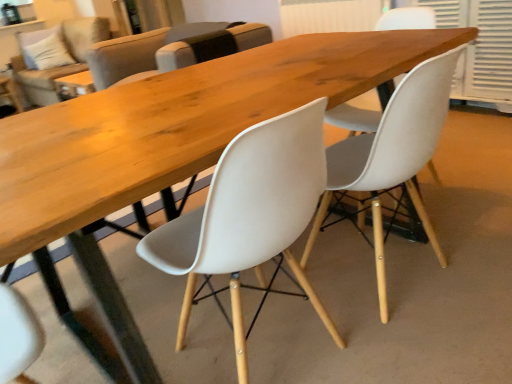
Where is `matte white chair at center, acting as the 3th chair starting from the back`? matte white chair at center, acting as the 3th chair starting from the back is located at coordinates (249, 217).

What do you see at coordinates (61, 65) in the screenshot?
I see `beige fabric couch at upper left` at bounding box center [61, 65].

The width and height of the screenshot is (512, 384). I want to click on white plastic chair at center, which is the 2th chair in back-to-front order, so click(x=393, y=155).

This screenshot has height=384, width=512. I want to click on matte white chair at center, which is the first chair from front to back, so click(249, 217).

From a real-world perspective, is beige fabric couch at upper left above or below white textured shutter at upper right?

From a real-world perspective, beige fabric couch at upper left is physically above white textured shutter at upper right.

Does beige fabric couch at upper left have a larger size compared to white textured shutter at upper right?

Indeed, beige fabric couch at upper left has a larger size compared to white textured shutter at upper right.

Consider the image. Considering the positions of objects beige fabric couch at upper left and white textured shutter at upper right in the image provided, who is more to the right, beige fabric couch at upper left or white textured shutter at upper right?

white textured shutter at upper right.

In the image, is matte white chair at center, acting as the 3th chair starting from the back, positioned in front of or behind white plastic chair at center, which is the 3th chair from front to back?

matte white chair at center, acting as the 3th chair starting from the back, is in front of white plastic chair at center, which is the 3th chair from front to back.

Is white plastic chair at center, acting as the first chair starting from the back, inside matte white chair at center, acting as the 3th chair starting from the back?

No, matte white chair at center, acting as the 3th chair starting from the back, does not contain white plastic chair at center, acting as the first chair starting from the back.

Between matte white chair at center, acting as the 3th chair starting from the back, and white plastic chair at center, acting as the first chair starting from the back, which one appears on the left side from the viewer's perspective?

white plastic chair at center, acting as the first chair starting from the back.

Considering the sizes of objects matte white chair at center, acting as the 3th chair starting from the back, and white plastic chair at center, which is the 3th chair from front to back, in the image provided, who is wider, matte white chair at center, acting as the 3th chair starting from the back, or white plastic chair at center, which is the 3th chair from front to back,?

white plastic chair at center, which is the 3th chair from front to back.

Which is in front, point (27, 64) or point (384, 191)?

The point (384, 191) is closer to the camera.

From the image's perspective, is beige fabric couch at upper left located above or below white plastic chair at center, the 2th chair viewed from the front?

beige fabric couch at upper left is situated higher than white plastic chair at center, the 2th chair viewed from the front, in the image.

Could white plastic chair at center, which is the 2th chair in back-to-front order, be considered to be inside beige fabric couch at upper left?

No, white plastic chair at center, which is the 2th chair in back-to-front order, is located outside of beige fabric couch at upper left.

Is beige fabric couch at upper left positioned with its back to white plastic chair at center, which is the 2th chair in back-to-front order?

No, white plastic chair at center, which is the 2th chair in back-to-front order, is not at the back of beige fabric couch at upper left.

Image resolution: width=512 pixels, height=384 pixels. In order to click on couch that is on the left side of matte white chair at center, which is the first chair from front to back in this screenshot , I will do `click(61, 65)`.

Is point (243, 257) positioned after point (39, 40)?

No, (243, 257) is in front of (39, 40).

Is matte white chair at center, acting as the 3th chair starting from the back, further to the viewer compared to beige fabric couch at upper left?

No, it is in front of beige fabric couch at upper left.

Considering the positions of objects white plastic chair at center, the 2th chair viewed from the front, and beige fabric couch at upper left in the image provided, who is in front, white plastic chair at center, the 2th chair viewed from the front, or beige fabric couch at upper left?

white plastic chair at center, the 2th chair viewed from the front, is more forward.

Is white plastic chair at center, which is the 2th chair in back-to-front order, facing towards beige fabric couch at upper left?

Yes.

Which of these two, white plastic chair at center, the 2th chair viewed from the front, or beige fabric couch at upper left, stands shorter?

white plastic chair at center, the 2th chair viewed from the front, is shorter.

Between white plastic chair at center, which is the 2th chair in back-to-front order, and beige fabric couch at upper left, which one has larger size?

Bigger between the two is beige fabric couch at upper left.

Which is less distant, (x=105, y=29) or (x=307, y=126)?

Point (x=307, y=126)

Would you say beige fabric couch at upper left contains matte white chair at center, acting as the 3th chair starting from the back?

No, beige fabric couch at upper left does not contain matte white chair at center, acting as the 3th chair starting from the back.

Can you confirm if beige fabric couch at upper left is positioned to the right of matte white chair at center, acting as the 3th chair starting from the back?

Incorrect, beige fabric couch at upper left is not on the right side of matte white chair at center, acting as the 3th chair starting from the back.

How many degrees apart are the facing directions of beige fabric couch at upper left and matte white chair at center, which is the first chair from front to back?

88.8 degrees separate the facing orientations of beige fabric couch at upper left and matte white chair at center, which is the first chair from front to back.

Is matte white chair at center, which is the first chair from front to back, positioned with its back to white textured shutter at upper right?

No, white textured shutter at upper right is not at the back of matte white chair at center, which is the first chair from front to back.

Considering the relative sizes of matte white chair at center, which is the first chair from front to back, and white textured shutter at upper right in the image provided, is matte white chair at center, which is the first chair from front to back, thinner than white textured shutter at upper right?

No, matte white chair at center, which is the first chair from front to back, is not thinner than white textured shutter at upper right.

Considering the sizes of objects matte white chair at center, acting as the 3th chair starting from the back, and white textured shutter at upper right in the image provided, who is bigger, matte white chair at center, acting as the 3th chair starting from the back, or white textured shutter at upper right?

white textured shutter at upper right is bigger.

The image size is (512, 384). In order to click on couch located behind the white textured shutter at upper right in this screenshot , I will do `click(61, 65)`.

Where is `chair that is the 2nd one when counting upward from the matte white chair at center, which is the first chair from front to back (from the image's perspective)`? The height and width of the screenshot is (384, 512). chair that is the 2nd one when counting upward from the matte white chair at center, which is the first chair from front to back (from the image's perspective) is located at coordinates (137, 51).

Based on the photo, looking at the image, which one is located closer to white textured shutter at upper right, white plastic chair at center, the 2th chair viewed from the front, or matte white chair at center, which is the first chair from front to back?

white plastic chair at center, the 2th chair viewed from the front, is positioned closer to the anchor white textured shutter at upper right.

When comparing their distances from matte white chair at center, which is the first chair from front to back, does white textured shutter at upper right or white plastic chair at center, which is the 3th chair from front to back, seem closer?

white textured shutter at upper right is positioned closer to the anchor matte white chair at center, which is the first chair from front to back.

Which object lies further to the anchor point white plastic chair at center, acting as the first chair starting from the back, white plastic chair at center, which is the 2th chair in back-to-front order, or beige fabric couch at upper left?

white plastic chair at center, which is the 2th chair in back-to-front order, lies further to white plastic chair at center, acting as the first chair starting from the back, than the other object.

When comparing their distances from beige fabric couch at upper left, does white textured shutter at upper right or white plastic chair at center, which is the 2th chair in back-to-front order, seem closer?

white textured shutter at upper right.

Based on their spatial positions, is beige fabric couch at upper left or matte white chair at center, which is the first chair from front to back, closer to white textured shutter at upper right?

The object closer to white textured shutter at upper right is matte white chair at center, which is the first chair from front to back.

When comparing their distances from white plastic chair at center, which is the 3th chair from front to back, does white textured shutter at upper right or white plastic chair at center, the 2th chair viewed from the front, seem closer?

The object closer to white plastic chair at center, which is the 3th chair from front to back, is white textured shutter at upper right.

Estimate the real-world distances between objects in this image. Which object is further from matte white chair at center, acting as the 3th chair starting from the back, white plastic chair at center, which is the 2th chair in back-to-front order, or beige fabric couch at upper left?

The object further to matte white chair at center, acting as the 3th chair starting from the back, is beige fabric couch at upper left.

Estimate the real-world distances between objects in this image. Which object is further from beige fabric couch at upper left, white plastic chair at center, the 2th chair viewed from the front, or white textured shutter at upper right?

white plastic chair at center, the 2th chair viewed from the front, is further to beige fabric couch at upper left.

Identify the location of chair between matte white chair at center, acting as the 3th chair starting from the back, and white textured shutter at upper right from front to back. (393, 155).

Identify the location of chair between white plastic chair at center, the 2th chair viewed from the front, and beige fabric couch at upper left from front to back. (137, 51).

Locate an element on the screen. The height and width of the screenshot is (384, 512). chair between matte white chair at center, acting as the 3th chair starting from the back, and white plastic chair at center, which is the 3th chair from front to back, from front to back is located at coordinates [x=393, y=155].